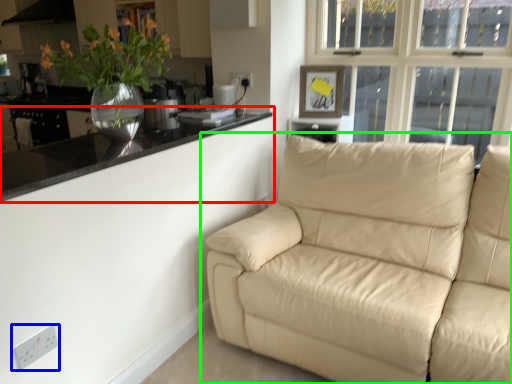
Question: Which object is the farthest from countertop (highlighted by a red box)? Choose among these: electric outlet (highlighted by a blue box) or studio couch (highlighted by a green box).

Choices:
 (A) electric outlet
 (B) studio couch

Answer: (B)